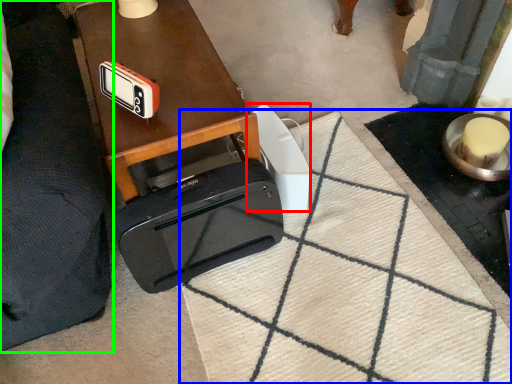
Question: Based on their relative distances, which object is farther from gadget (highlighted by a red box)? Choose from doormat (highlighted by a blue box) and furniture (highlighted by a green box).

Choices:
 (A) doormat
 (B) furniture

Answer: (B)